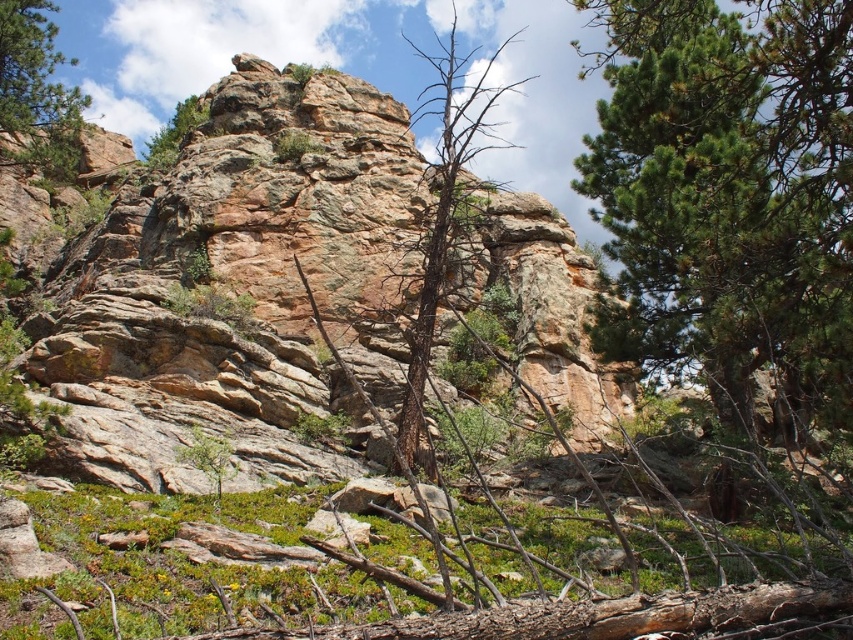
Question: Is brown rough tree at center thinner than green pine tree at upper left?

Choices:
 (A) no
 (B) yes

Answer: (B)

Question: Which is farther from the brown rough tree at center?

Choices:
 (A) rustic stone cliff at center
 (B) green pine tree at upper left
 (C) green textured tree at center
 (D) green textured tree at upper center

Answer: (D)

Question: Which of the following is the farthest from the observer?

Choices:
 (A) (299, 150)
 (B) (838, 195)
 (C) (496, 96)

Answer: (C)

Question: Which object is closer to the camera taking this photo?

Choices:
 (A) rustic stone cliff at center
 (B) green textured tree at upper center
 (C) green textured tree at center
 (D) brown rough tree at center

Answer: (D)

Question: Does rustic stone cliff at center appear on the right side of green pine tree at upper left?

Choices:
 (A) yes
 (B) no

Answer: (A)

Question: Can you confirm if rustic stone cliff at center is wider than green pine tree at upper left?

Choices:
 (A) no
 (B) yes

Answer: (B)